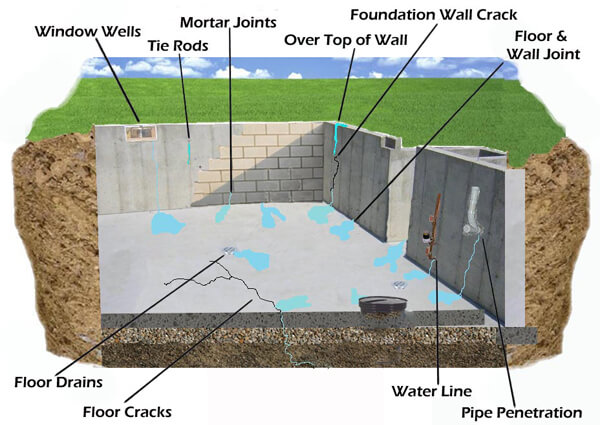
Where is `floor`? The height and width of the screenshot is (425, 600). floor is located at coordinates (533, 38).